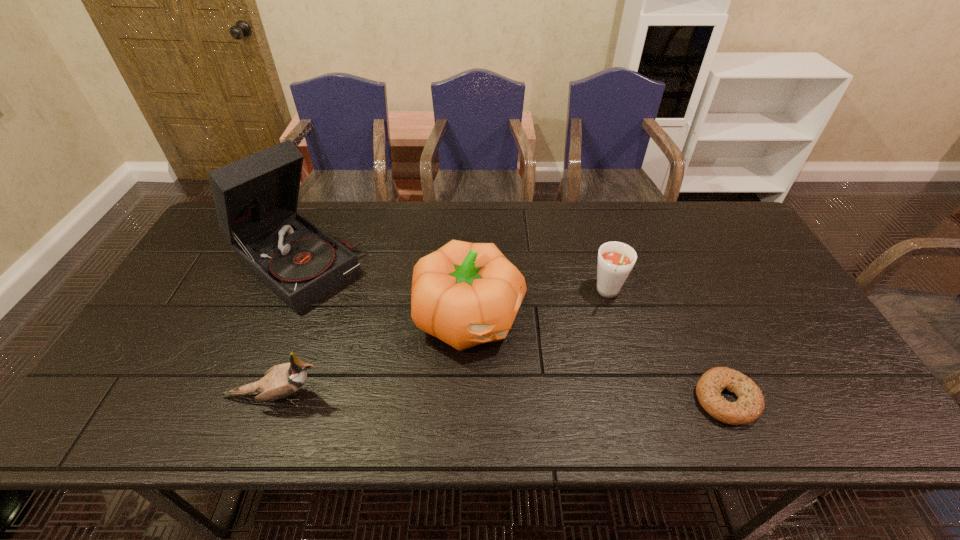
This screenshot has height=540, width=960. In order to click on object situated at the left edge in this screenshot , I will do `click(255, 198)`.

I want to click on object that is at the far left corner, so click(x=255, y=198).

Where is `vacant space at the far edge of the desktop`? vacant space at the far edge of the desktop is located at coordinates (438, 209).

Find the location of a particular element. The image size is (960, 540). vacant space at the near edge of the desktop is located at coordinates (502, 388).

This screenshot has height=540, width=960. In order to click on free space at the left edge in this screenshot , I will do `click(170, 360)`.

In the image, there is a desktop. At what (x,y) coordinates should I click in order to perform the action: click on vacant area at the right edge. Please return your answer as a coordinate pair (x, y). Looking at the image, I should click on (756, 316).

Where is `vacant space at the near left corner of the desktop`? The image size is (960, 540). vacant space at the near left corner of the desktop is located at coordinates (180, 370).

What are the coordinates of `vacant space at the far right corner of the desktop` in the screenshot? It's located at (730, 245).

Where is `vacant area between the pumpkin and the bagel`? Image resolution: width=960 pixels, height=540 pixels. vacant area between the pumpkin and the bagel is located at coordinates (598, 359).

Image resolution: width=960 pixels, height=540 pixels. I want to click on vacant space that is in between the pumpkin and the tallest object, so click(382, 291).